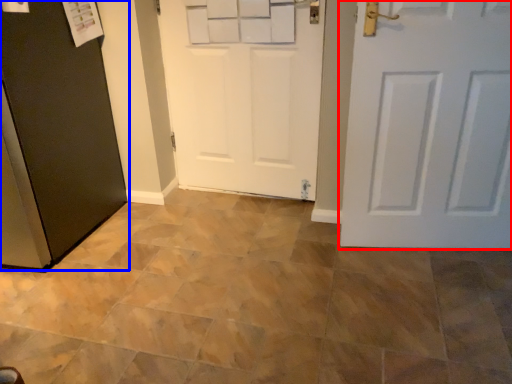
Question: Among these objects, which one is nearest to the camera, door (highlighted by a red box) or door (highlighted by a blue box)?

Choices:
 (A) door
 (B) door

Answer: (B)